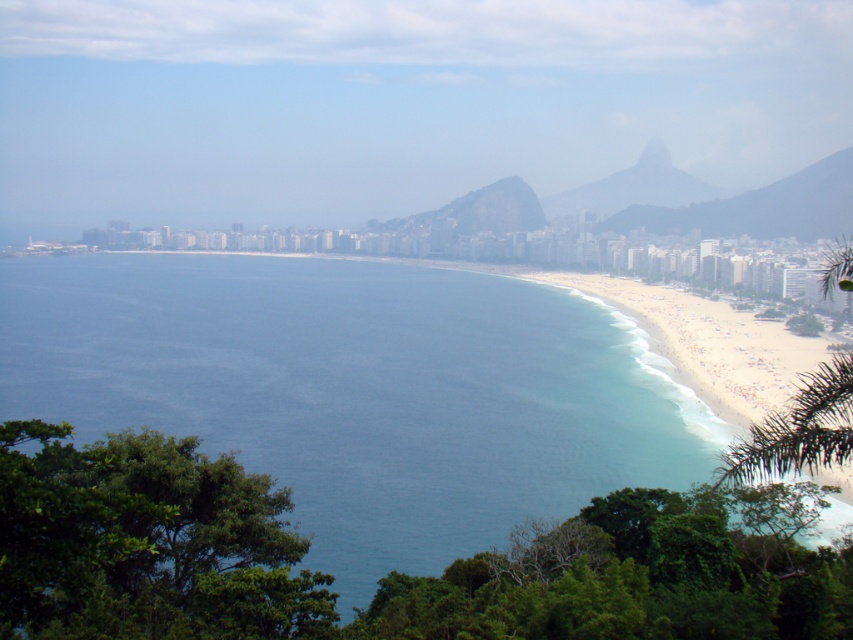
Question: Considering the real-world distances, which object is closest to the green textured rock at center?

Choices:
 (A) gray rocky mountain at upper right
 (B) blue water at center

Answer: (A)

Question: Does blue water at center lie in front of white sand beach at center?

Choices:
 (A) yes
 (B) no

Answer: (B)

Question: Does blue water at center have a larger size compared to white sand beach at center?

Choices:
 (A) no
 (B) yes

Answer: (B)

Question: Is white sand beach at center below green textured rock at center?

Choices:
 (A) yes
 (B) no

Answer: (A)

Question: Among these points, which one is farthest from the camera?

Choices:
 (A) (200, 317)
 (B) (828, 180)

Answer: (B)

Question: Considering the real-world distances, which object is farthest from the green textured rock at center?

Choices:
 (A) gray rocky mountain at upper right
 (B) blue water at center

Answer: (B)